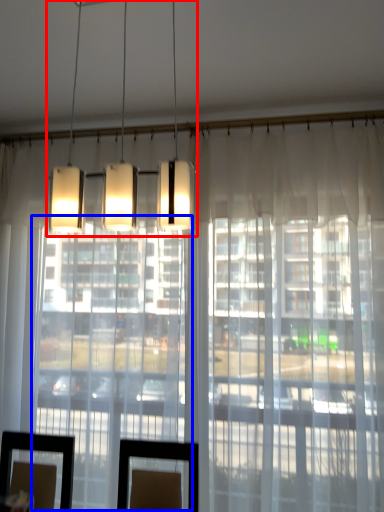
Question: Which object is closer to the camera taking this photo, lamp (highlighted by a red box) or glass door (highlighted by a blue box)?

Choices:
 (A) lamp
 (B) glass door

Answer: (A)